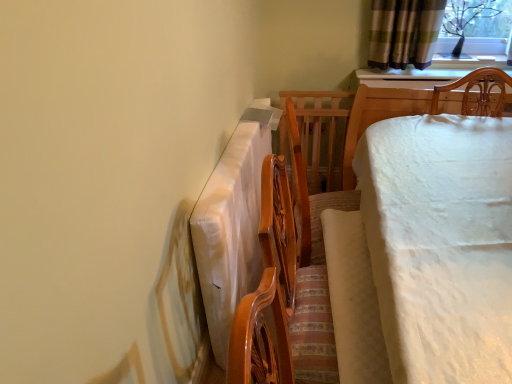
Question: Considering their positions, is clear glass window screen at upper right located in front of or behind white fabric-covered bed at right?

Choices:
 (A) behind
 (B) front

Answer: (A)

Question: Considering the positions of clear glass window screen at upper right and white fabric-covered bed at right in the image, is clear glass window screen at upper right wider or thinner than white fabric-covered bed at right?

Choices:
 (A) wide
 (B) thin

Answer: (B)

Question: Based on their relative distances, which object is nearer to the clear glass window screen at upper right?

Choices:
 (A) white fabric-covered bed at right
 (B) white plastic tablecloth at center
 (C) light beige fabric at center

Answer: (A)

Question: Which is nearer to the light beige fabric at center?

Choices:
 (A) clear glass window screen at upper right
 (B) white plastic tablecloth at center
 (C) white fabric-covered bed at right

Answer: (C)